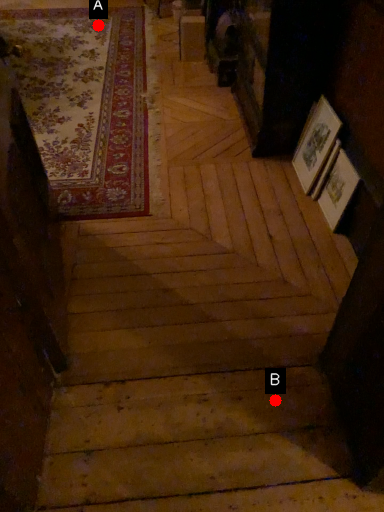
Question: Two points are circled on the image, labeled by A and B beside each circle. Which point is closer to the camera?

Choices:
 (A) A is closer
 (B) B is closer

Answer: (B)